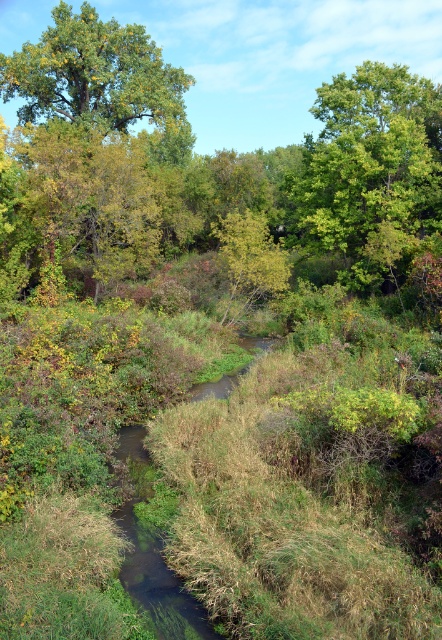
Between green leafy tree at upper right and green leafy tree at center, which one is positioned lower?

green leafy tree at center

Is point (434, 88) more distant than point (285, 275)?

Yes, point (434, 88) is farther from viewer.

This screenshot has width=442, height=640. Identify the location of green leafy tree at upper right. (372, 173).

Can you confirm if green leafy tree at upper left is wider than green leafy tree at center?

Yes, green leafy tree at upper left is wider than green leafy tree at center.

Locate an element on the screen. green leafy tree at upper left is located at coordinates point(99,77).

Between point (407, 74) and point (86, 42), which one is positioned in front?

Positioned in front is point (407, 74).

Is green leafy tree at upper right to the right of green leafy tree at upper left from the viewer's perspective?

Indeed, green leafy tree at upper right is positioned on the right side of green leafy tree at upper left.

Is point (397, 161) in front of point (77, 92)?

Yes, point (397, 161) is in front of point (77, 92).

Where is `green leafy tree at upper right`? The width and height of the screenshot is (442, 640). green leafy tree at upper right is located at coordinates (372, 173).